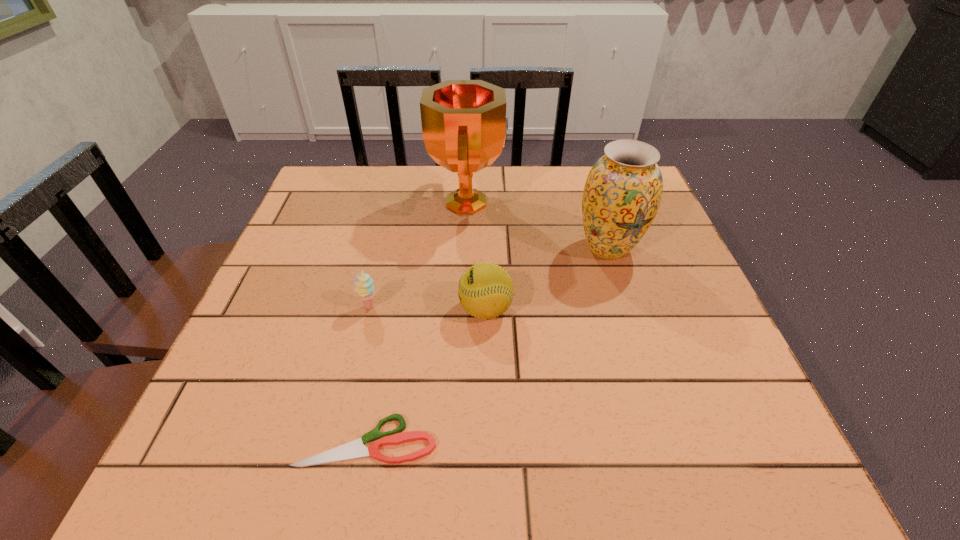
This screenshot has height=540, width=960. I want to click on vacant area situated 0.180m on the logo side of the softball, so click(372, 309).

Find the location of a particular element. This screenshot has width=960, height=540. vacant space located on the logo side of the softball is located at coordinates coord(313,309).

This screenshot has height=540, width=960. I want to click on free spot located on the back of the sherbert, so (x=379, y=267).

Identify the location of free location located on the back of the nearest object. (393, 309).

Locate an element on the screen. The height and width of the screenshot is (540, 960). object at the far edge is located at coordinates (464, 125).

In order to click on object that is positioned at the near edge in this screenshot , I will do `click(356, 449)`.

Where is `object at the right edge`? Image resolution: width=960 pixels, height=540 pixels. object at the right edge is located at coordinates (623, 191).

In the image, there is a desktop. Where is `free space at the far edge`? This screenshot has width=960, height=540. free space at the far edge is located at coordinates (543, 204).

Find the location of `free space at the near edge of the desktop`. free space at the near edge of the desktop is located at coordinates (505, 463).

Identify the location of vacant space at the left edge of the desktop. (285, 326).